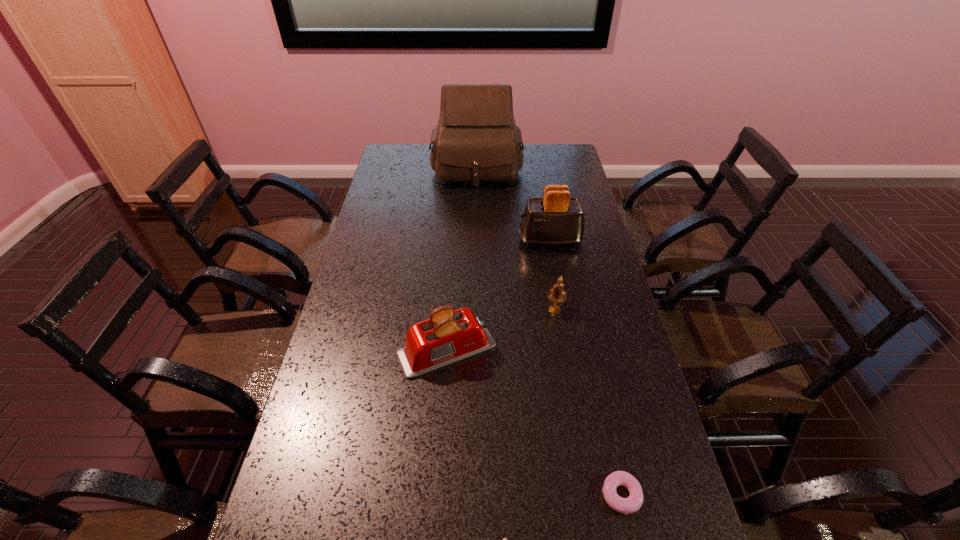
What are the coordinates of `the tallest object` in the screenshot? It's located at (476, 140).

What are the coordinates of `the farthest object` in the screenshot? It's located at (476, 140).

You are a GUI agent. You are given a task and a screenshot of the screen. Output one action in this format:
    pyautogui.click(x=<x>, y=<y>)
    Task: Click on the farther toaster
    The width and height of the screenshot is (960, 540).
    Given the screenshot: What is the action you would take?
    pyautogui.click(x=556, y=219)

The width and height of the screenshot is (960, 540). What are the coordinates of `the right toaster` in the screenshot? It's located at (556, 219).

Find the location of `the third nearest object`. the third nearest object is located at coordinates (449, 336).

Locate an element on the screen. the nearer toaster is located at coordinates (x=449, y=336).

The height and width of the screenshot is (540, 960). In order to click on candle holder in this screenshot , I will do `click(557, 295)`.

Locate an element on the screen. the second nearest object is located at coordinates (633, 503).

Where is `doughnut`? The height and width of the screenshot is (540, 960). doughnut is located at coordinates (633, 503).

This screenshot has height=540, width=960. I want to click on free location located 0.160m on the front flap of the tallest object, so click(476, 212).